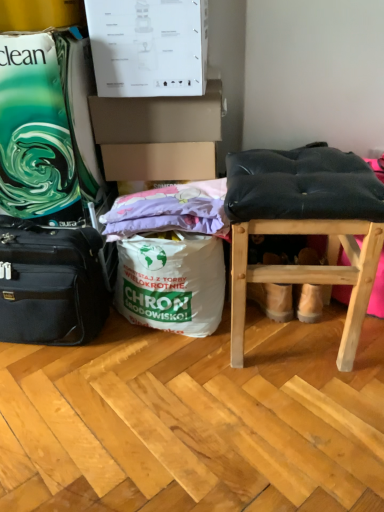
Question: Could black fabric suitcase at left be considered to be inside purple fabric at center?

Choices:
 (A) no
 (B) yes

Answer: (A)

Question: Considering the relative positions of purple fabric at center and black fabric suitcase at left in the image provided, is purple fabric at center to the left of black fabric suitcase at left from the viewer's perspective?

Choices:
 (A) no
 (B) yes

Answer: (A)

Question: Is purple fabric at center next to black fabric suitcase at left?

Choices:
 (A) no
 (B) yes

Answer: (A)

Question: Is black fabric suitcase at left at the back of purple fabric at center?

Choices:
 (A) no
 (B) yes

Answer: (A)

Question: Can you confirm if purple fabric at center is positioned to the right of black fabric suitcase at left?

Choices:
 (A) no
 (B) yes

Answer: (B)

Question: Considering the positions of purple fabric at center and white paper bag at center in the image, is purple fabric at center wider or thinner than white paper bag at center?

Choices:
 (A) thin
 (B) wide

Answer: (A)

Question: Would you say purple fabric at center is to the left or to the right of white paper bag at center in the picture?

Choices:
 (A) right
 (B) left

Answer: (B)

Question: From the image's perspective, is purple fabric at center positioned above or below white paper bag at center?

Choices:
 (A) below
 (B) above

Answer: (B)

Question: Choose the correct answer: Is purple fabric at center inside white paper bag at center or outside it?

Choices:
 (A) outside
 (B) inside

Answer: (A)

Question: From the image's perspective, is purple fabric at center above or below black fabric suitcase at left?

Choices:
 (A) above
 (B) below

Answer: (A)

Question: From their relative heights in the image, would you say purple fabric at center is taller or shorter than black fabric suitcase at left?

Choices:
 (A) tall
 (B) short

Answer: (B)

Question: Relative to black fabric suitcase at left, is purple fabric at center in front or behind?

Choices:
 (A) front
 (B) behind

Answer: (B)

Question: Is purple fabric at center inside or outside of black fabric suitcase at left?

Choices:
 (A) inside
 (B) outside

Answer: (B)

Question: Based on their sizes in the image, would you say white paper bag at center is bigger or smaller than black fabric suitcase at left?

Choices:
 (A) small
 (B) big

Answer: (B)

Question: From a real-world perspective, is white paper bag at center positioned above or below black fabric suitcase at left?

Choices:
 (A) below
 (B) above

Answer: (A)